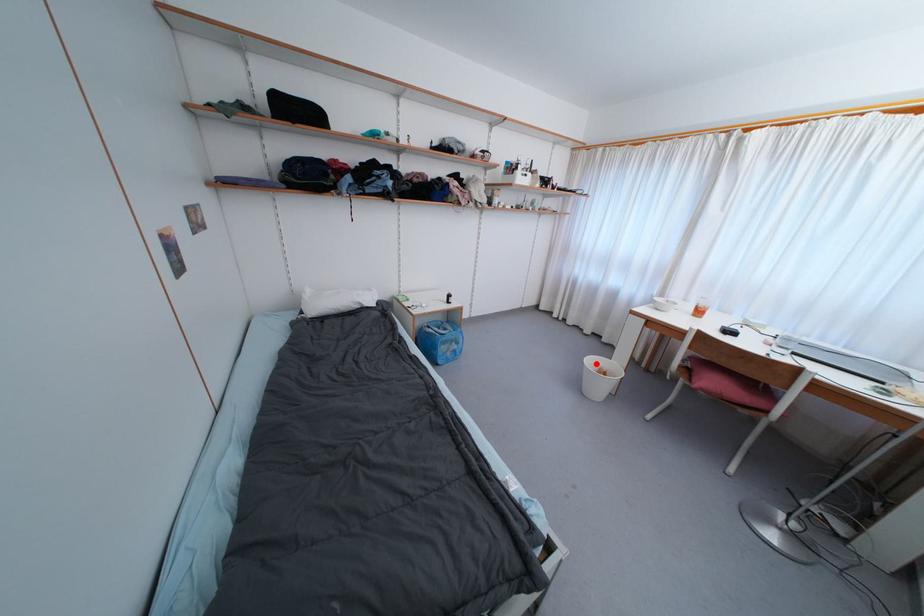
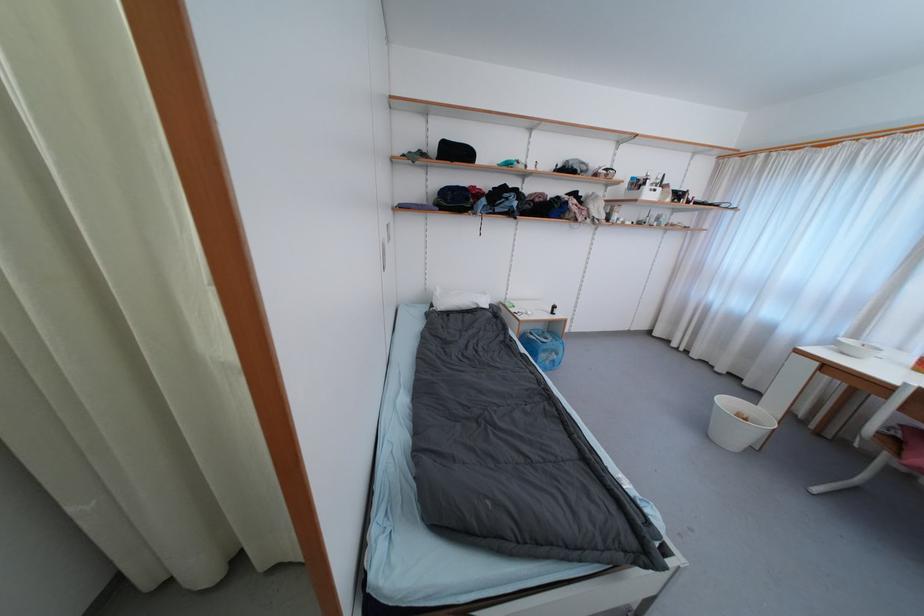
Question: I am providing you with two images of the same scene from different viewpoints. Image1 has a red point marked. In image2, the corresponding 3D location appears at what relative position? Reply with the corresponding letter.

Choices:
 (A) Closer
 (B) Farther

Answer: (B)